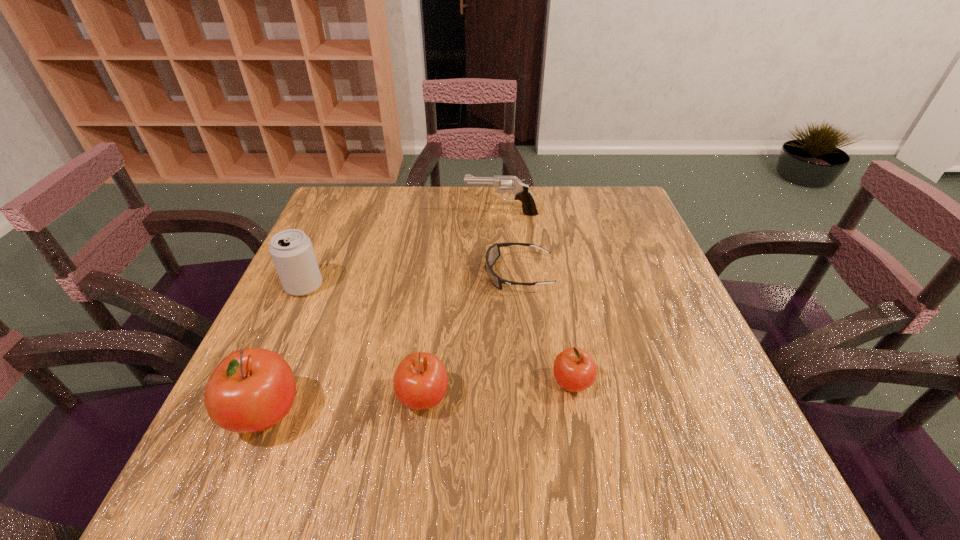
Find the location of `apple that is the second closest to the shortest object`. apple that is the second closest to the shortest object is located at coordinates (420, 382).

Locate an element on the screen. Image resolution: width=960 pixels, height=540 pixels. the closest apple relative to the fourth object from right to left is located at coordinates [252, 389].

Where is `free region that satisfies the following two spatial constraints: 1. on the front side of the third object from left to right; 2. on the right side of the can`? This screenshot has width=960, height=540. free region that satisfies the following two spatial constraints: 1. on the front side of the third object from left to right; 2. on the right side of the can is located at coordinates (254, 398).

Identify the location of free spot that satisfies the following two spatial constraints: 1. at the muzzle of the farthest object; 2. on the front side of the tallest object. The width and height of the screenshot is (960, 540). (515, 414).

Where is `free space that satisfies the following two spatial constraints: 1. on the lenses of the goggles; 2. on the right side of the rightmost apple`? free space that satisfies the following two spatial constraints: 1. on the lenses of the goggles; 2. on the right side of the rightmost apple is located at coordinates (530, 383).